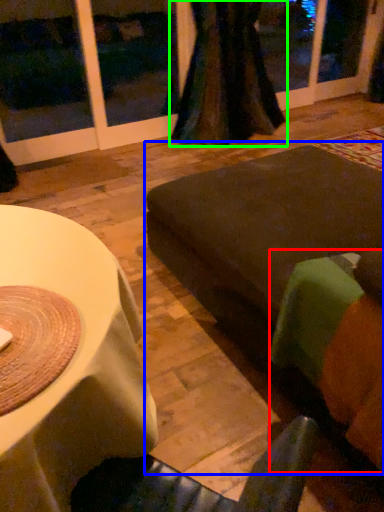
Question: Estimate the real-world distances between objects in this image. Which object is closer to couch (highlighted by a red box), couch (highlighted by a blue box) or curtain (highlighted by a green box)?

Choices:
 (A) couch
 (B) curtain

Answer: (A)